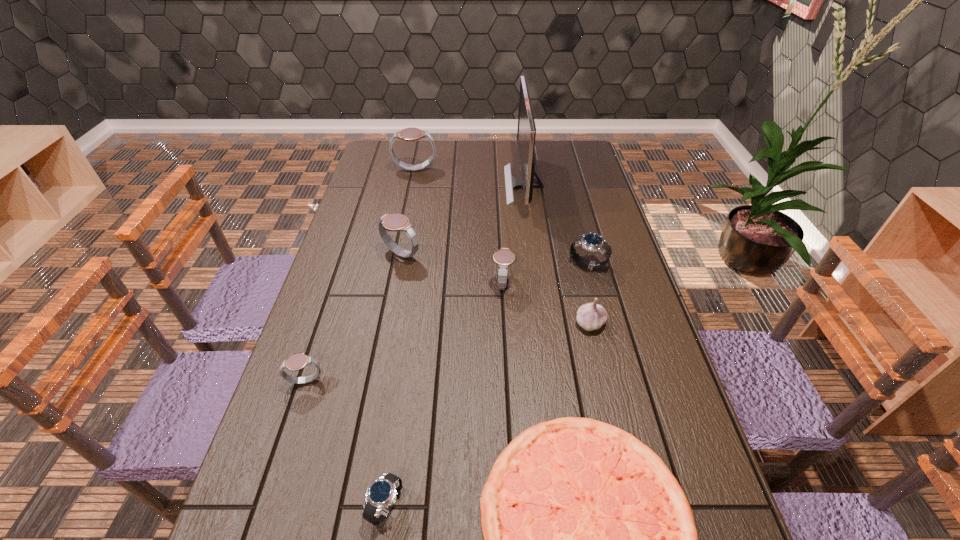
Locate an element on the screen. vacant space that satisfies the following two spatial constraints: 1. on the screen side of the garlic; 2. on the left side of the tallest object is located at coordinates (542, 323).

Find the location of a particular element. This screenshot has height=540, width=960. vacant region that satisfies the following two spatial constraints: 1. on the screen side of the monitor; 2. on the right side of the fourth nearest object is located at coordinates (542, 323).

You are a GUI agent. You are given a task and a screenshot of the screen. Output one action in this format:
    pyautogui.click(x=<x>, y=<y>)
    Task: Click on the free point that satisfies the following two spatial constraints: 1. on the front side of the right silver watch; 2. on the right side of the second tallest object
    The image size is (960, 540).
    Given the screenshot: What is the action you would take?
    pyautogui.click(x=396, y=265)